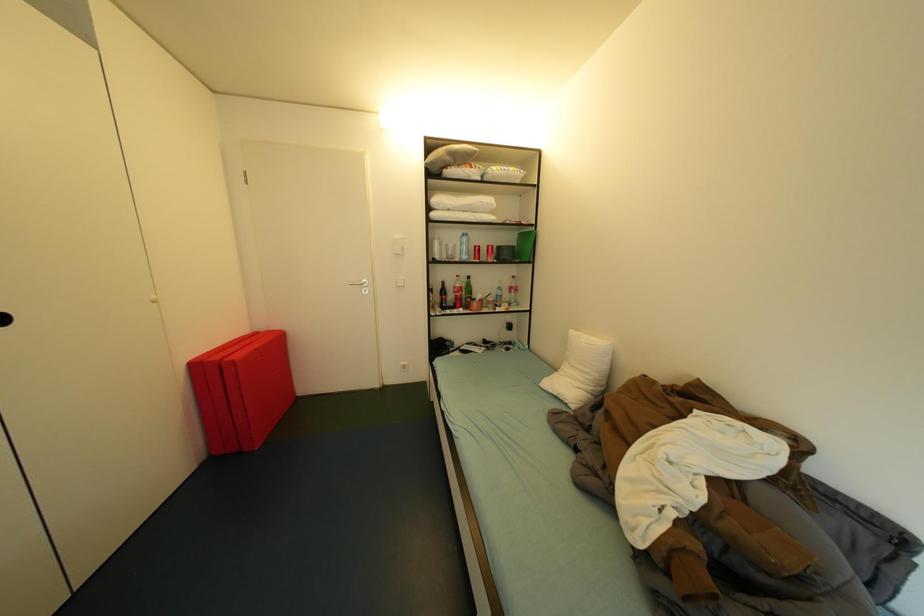
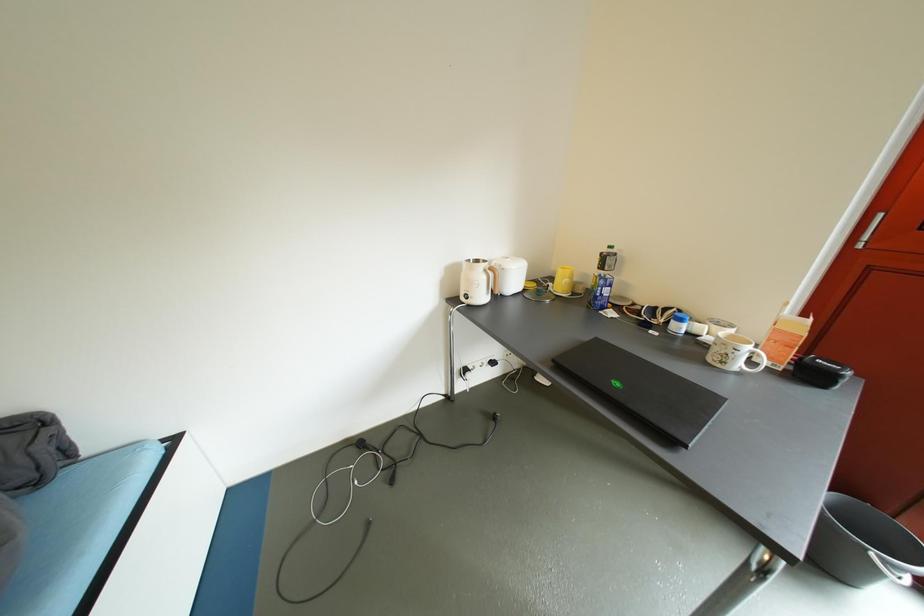
In the scene shown: The first image is from the beginning of the video and the second image is from the end. How did the camera likely rotate when shooting the video?

The camera rotated toward right-down.